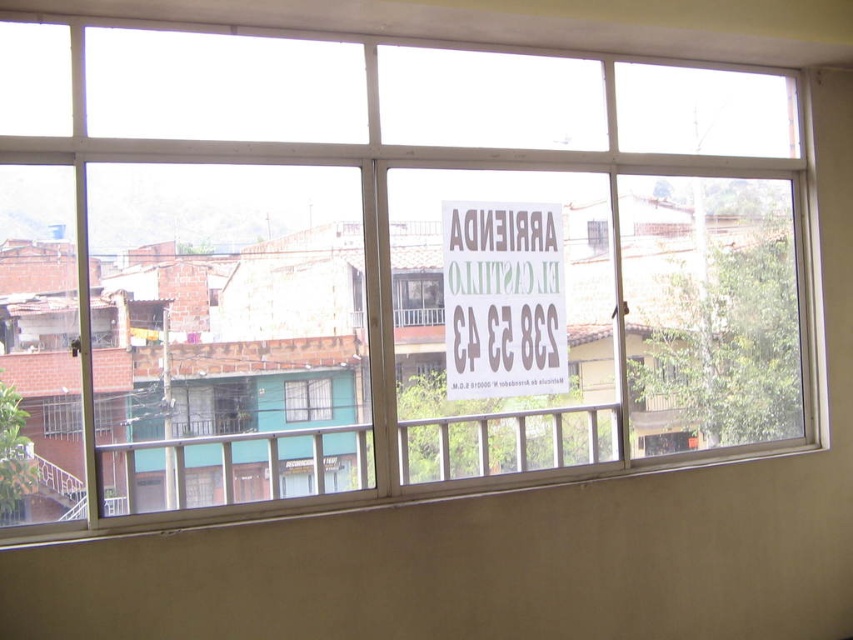
What is the purpose of the sign located at point (503, 300) in the image?

The point (503, 300) indicates a brown cardboard sign at center, which reads ARRIENDO meaning the property is for rent.

You are a delivery person trying to place a brown cardboard sign at center on the clear glass window at center. The minimum distance required between the sign and the window for it to be visible is 60 centimeters. Can you place it there?

The distance of brown cardboard sign at center from clear glass window at center is 73.10 centimeters, which exceeds the minimum required distance of 60 centimeters. Therefore, placing the brown cardboard sign at center on the clear glass window at center will ensure visibility.

Okay, let me try to work through this step by step. First, I need to generate a question and answer based on the provided information. The scene is a window with a sign. The objects are the brown cardboard sign at center and the clear glass window at center. The objects description says the sign might be wider than the window. The question has to mention both objects exactly as listed. Since the description is about width, maybe the question should ask about which is wider. But the answer has to be

Wait, the user provided an example where the question was about fitting something based on size. Here, the objects description says the sign might be wider than the window. But the question can only use the scene and objects, not the description details. Hmm, the rules say the question shouldn not reveal the specific details from the objects description. So the question should be a comparison without stating which is which. The scene mentions the window has a metal frame divided into panes, and the